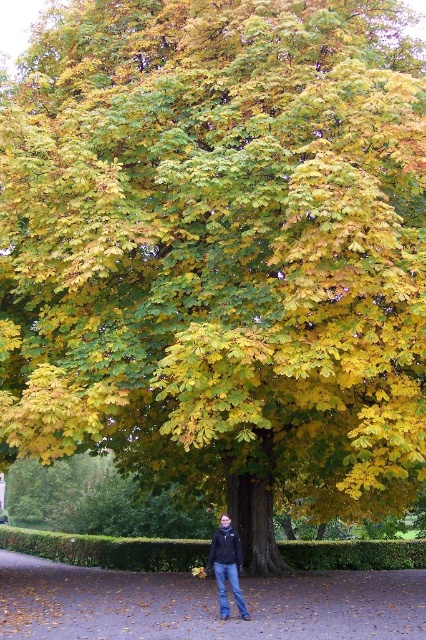
Does brown dirt path at center have a lesser height compared to dark blue jeans at center?

Incorrect, brown dirt path at center's height does not fall short of dark blue jeans at center's.

Does brown dirt path at center have a smaller size compared to dark blue jeans at center?

No, brown dirt path at center is not smaller than dark blue jeans at center.

Describe the element at coordinates (204, 604) in the screenshot. The height and width of the screenshot is (640, 426). I see `brown dirt path at center` at that location.

Where is `brown dirt path at center`? brown dirt path at center is located at coordinates (204, 604).